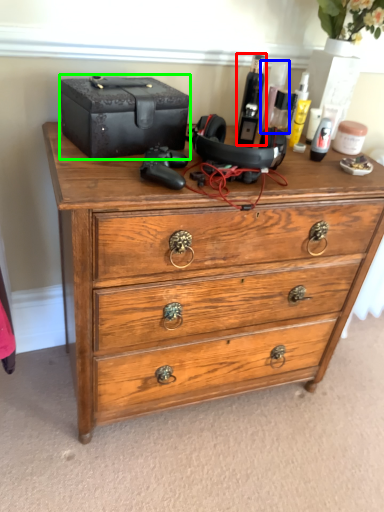
Question: Estimate the real-world distances between objects in this image. Which object is farther from toiletry (highlighted by a red box), toiletry (highlighted by a blue box) or storage box (highlighted by a green box)?

Choices:
 (A) toiletry
 (B) storage box

Answer: (B)